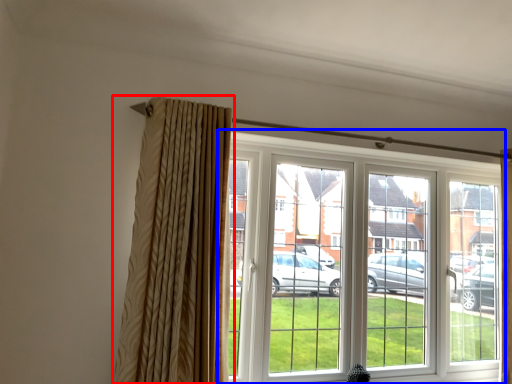
Question: Which point is further to the camera, curtain (highlighted by a red box) or window (highlighted by a blue box)?

Choices:
 (A) curtain
 (B) window

Answer: (B)